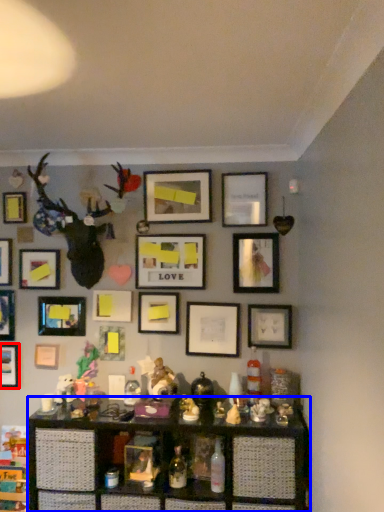
Question: Among these objects, which one is farthest to the camera, picture frame (highlighted by a red box) or shelf (highlighted by a blue box)?

Choices:
 (A) picture frame
 (B) shelf

Answer: (A)